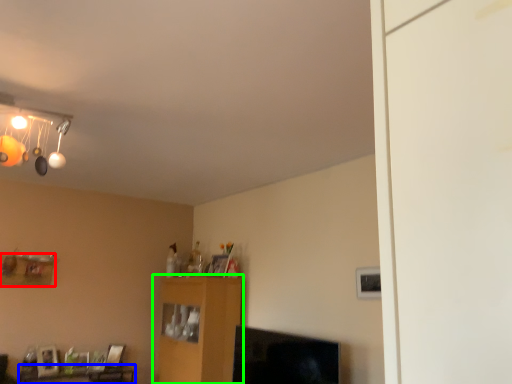
Question: Which object is the farthest from shelf (highlighted by a red box)? Choose among these: table (highlighted by a blue box) or furniture (highlighted by a green box).

Choices:
 (A) table
 (B) furniture

Answer: (B)